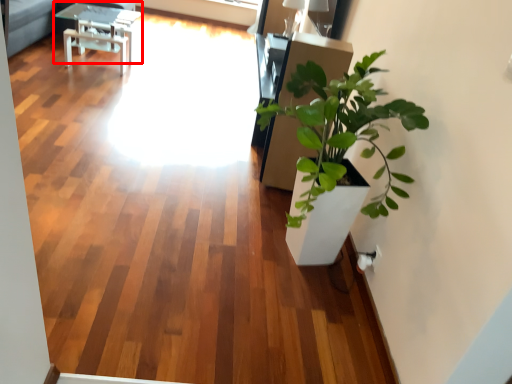
Question: Considering the relative positions of table (annotated by the red box) and window screen in the image provided, where is table (annotated by the red box) located with respect to the staircase?

Choices:
 (A) right
 (B) left

Answer: (B)